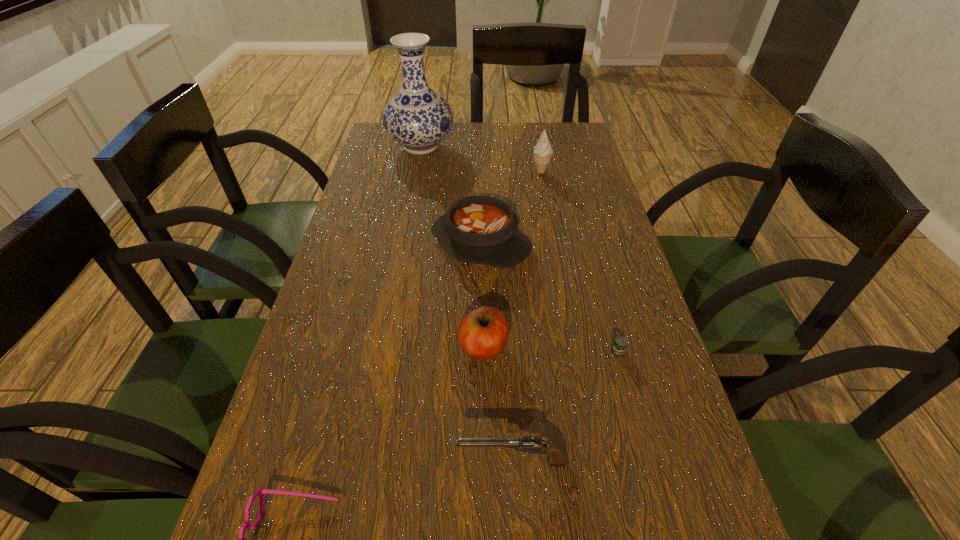
Find the location of `object that is the fourth nearest to the rightmost object`. object that is the fourth nearest to the rightmost object is located at coordinates (260, 492).

Locate which object is the closest to the tallest object. Please provide its 2D coordinates. Your answer should be formatted as a tuple, i.e. [(x, y)], where the tuple contains the x and y coordinates of a point satisfying the conditions above.

[(542, 151)]

The image size is (960, 540). What are the coordinates of `free location that satisfies the following two spatial constraints: 1. on the front side of the shortest object; 2. on the left side of the apple` in the screenshot? It's located at (484, 352).

This screenshot has height=540, width=960. Find the location of `free location that satisfies the following two spatial constraints: 1. on the front-facing side of the beer can; 2. on the left side of the icecream`. free location that satisfies the following two spatial constraints: 1. on the front-facing side of the beer can; 2. on the left side of the icecream is located at coordinates (574, 352).